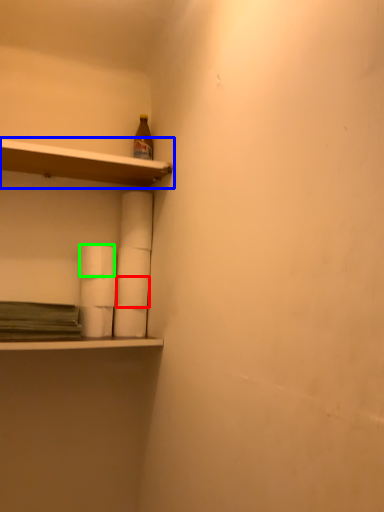
Question: Considering the real-world distances, which object is closest to paper towel (highlighted by a red box)? shelf (highlighted by a blue box) or paper towel (highlighted by a green box).

Choices:
 (A) shelf
 (B) paper towel

Answer: (B)